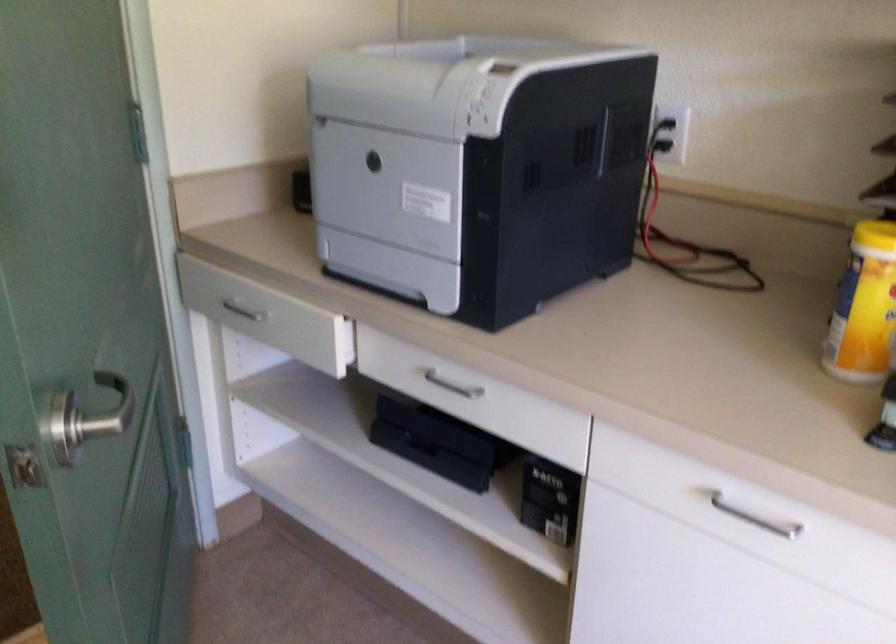
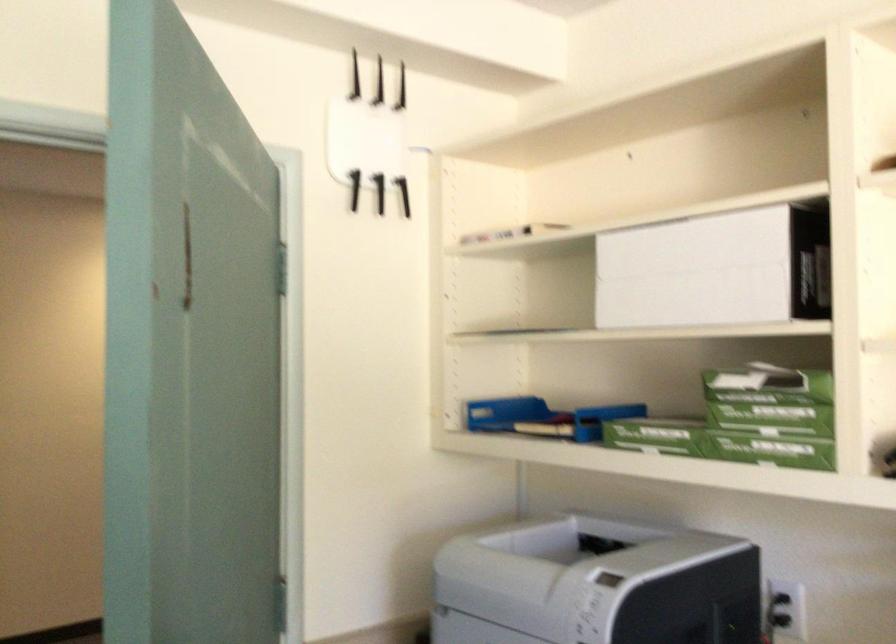
In the second image, find the point that corresponds to (x=666, y=122) in the first image.

(782, 609)